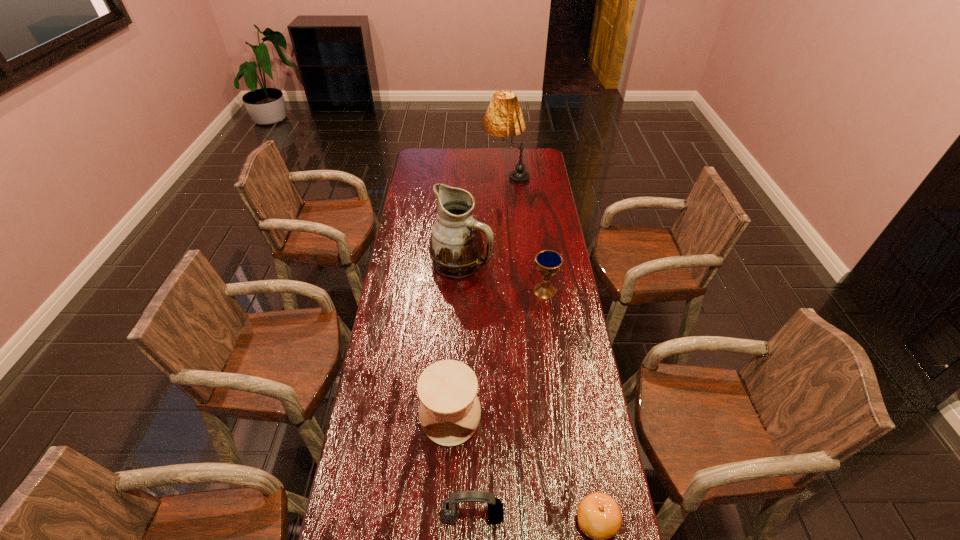
Identify the location of free space that satisfies the following two spatial constraints: 1. from the spout of the second tallest object; 2. on the right side of the chalice. Image resolution: width=960 pixels, height=540 pixels. (460, 291).

At what (x,y) coordinates should I click in order to perform the action: click on free point that satisfies the following two spatial constraints: 1. from the spout of the chalice; 2. on the left side of the pitcher. Please return your answer as a coordinate pair (x, y). Looking at the image, I should click on (460, 291).

The height and width of the screenshot is (540, 960). In order to click on free space that satisfies the following two spatial constraints: 1. on the front-facing side of the farthest object; 2. at the open side of the third tallest object in this screenshot , I will do `click(523, 419)`.

Where is `vacant position in the image that satisfies the following two spatial constraints: 1. on the back side of the chalice; 2. from the spout of the pitcher`? This screenshot has height=540, width=960. vacant position in the image that satisfies the following two spatial constraints: 1. on the back side of the chalice; 2. from the spout of the pitcher is located at coordinates (540, 263).

At what (x,y) coordinates should I click in order to perform the action: click on free space that satisfies the following two spatial constraints: 1. on the front-facing side of the lampshade; 2. on the headband of the headset. Please return your answer as a coordinate pair (x, y). Image resolution: width=960 pixels, height=540 pixels. Looking at the image, I should click on (530, 515).